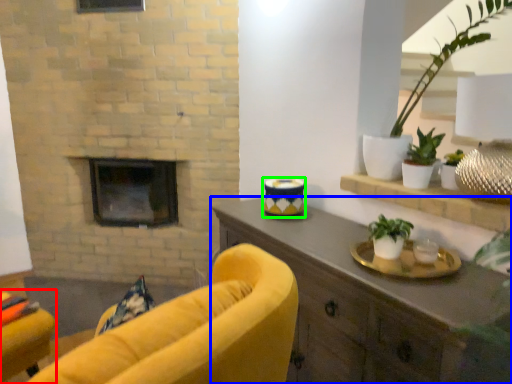
Question: Which object is the farthest from chair (highlighted by a red box)? Choose among these: cabinetry (highlighted by a blue box) or candle holder (highlighted by a green box).

Choices:
 (A) cabinetry
 (B) candle holder

Answer: (B)